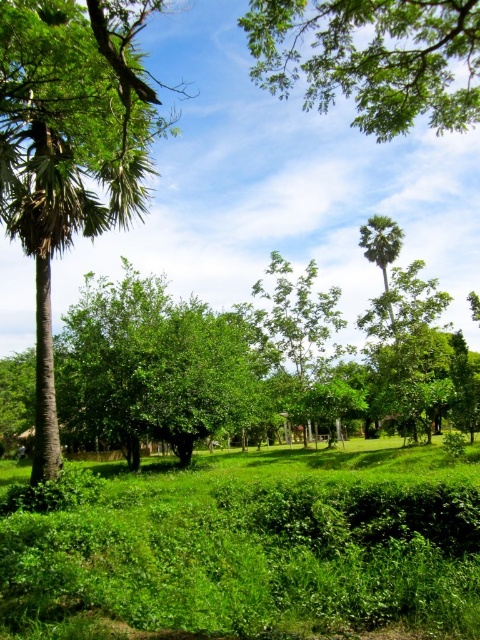
Question: Which is nearer to the green grass at center?

Choices:
 (A) green leafy tree at upper center
 (B) green leafy palm at upper center

Answer: (A)

Question: Does green grass at center have a lesser width compared to green leafy palm at upper center?

Choices:
 (A) yes
 (B) no

Answer: (B)

Question: Which object is farther from the camera taking this photo?

Choices:
 (A) green grass at center
 (B) green leafy palm at upper center
 (C) green leafy tree at upper center

Answer: (B)

Question: Can you confirm if green grass at center is positioned to the left of green leafy palm at upper center?

Choices:
 (A) yes
 (B) no

Answer: (A)

Question: Which object is closer to the camera taking this photo?

Choices:
 (A) green grass at center
 (B) green leafy tree at upper center

Answer: (A)

Question: Is green grass at center positioned behind green leafy palm at upper center?

Choices:
 (A) no
 (B) yes

Answer: (A)